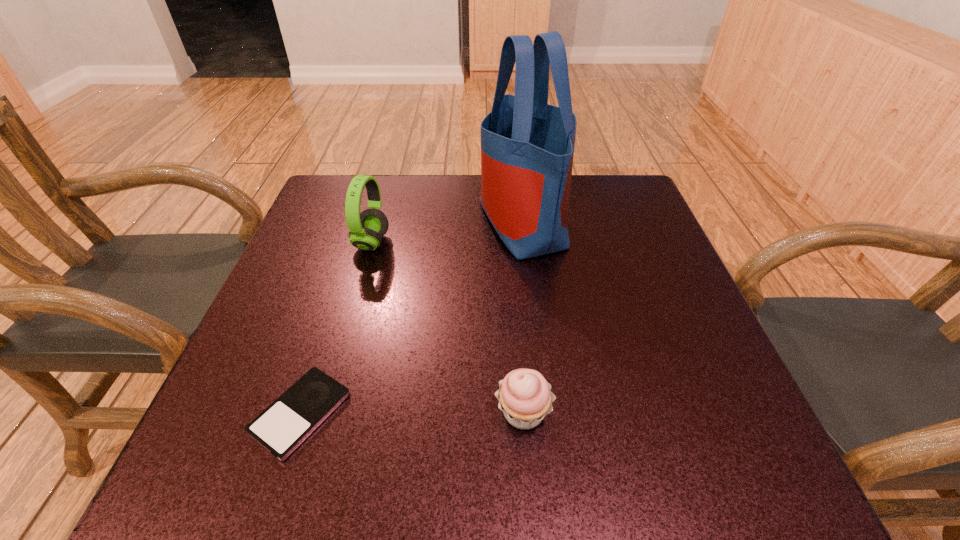
The width and height of the screenshot is (960, 540). In order to click on free spot at the far right corner of the desktop in this screenshot , I will do `click(588, 179)`.

At what (x,y) coordinates should I click in order to perform the action: click on vacant area between the second shortest object and the third shortest object. Please return your answer as a coordinate pair (x, y). Looking at the image, I should click on (447, 327).

Locate an element on the screen. This screenshot has height=540, width=960. empty space that is in between the shortest object and the cupcake is located at coordinates (412, 413).

What are the coordinates of `blank region between the third shortest object and the handbag` in the screenshot? It's located at (446, 233).

You are a GUI agent. You are given a task and a screenshot of the screen. Output one action in this format:
    pyautogui.click(x=<x>, y=<y>)
    Task: Click on the blank region between the cupcake and the third shortest object
    The width and height of the screenshot is (960, 540).
    Given the screenshot: What is the action you would take?
    pyautogui.click(x=447, y=327)

Locate an element on the screen. free space that is in between the shortest object and the cupcake is located at coordinates (412, 413).

At what (x,y) coordinates should I click in order to perform the action: click on vacant area that lies between the handbag and the third shortest object. Please return your answer as a coordinate pair (x, y). Looking at the image, I should click on (446, 233).

Where is `free space between the iPod and the cupcake`? free space between the iPod and the cupcake is located at coordinates (412, 413).

The image size is (960, 540). I want to click on vacant area that lies between the handbag and the cupcake, so click(x=522, y=317).

Identify the location of free space between the third tallest object and the shortest object. The height and width of the screenshot is (540, 960). (412, 413).